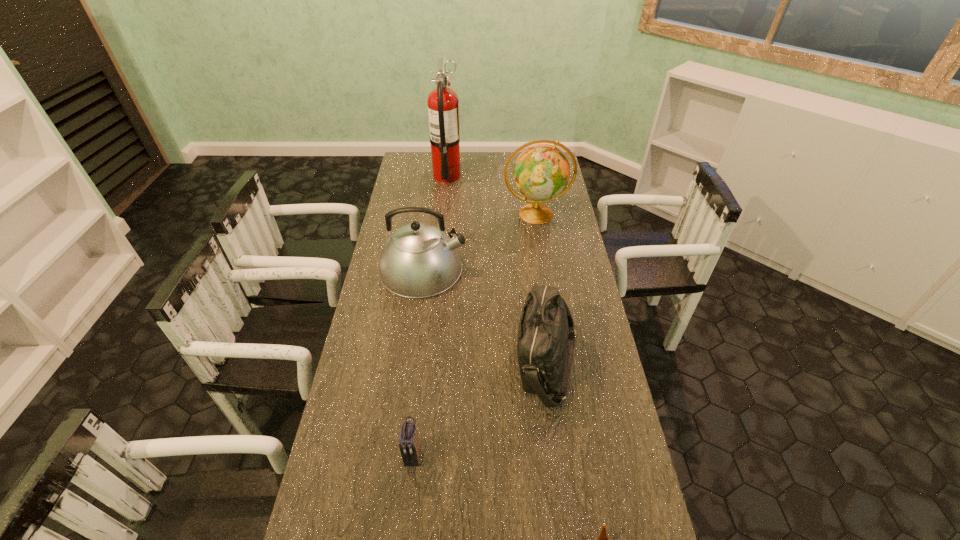
I want to click on vacant area situated from the spout of the kettle, so click(x=564, y=268).

Locate an element on the screen. This screenshot has height=540, width=960. vacant position located at the front padded panel of the shoulder bag is located at coordinates (430, 363).

You are a GUI agent. You are given a task and a screenshot of the screen. Output one action in this format:
    pyautogui.click(x=<x>, y=<y>)
    Task: Click on the vacant region located 0.150m at the front padded panel of the shoulder bag
    This screenshot has width=960, height=540.
    Given the screenshot: What is the action you would take?
    tap(466, 363)

Find the location of `vacant space located 0.220m at the front padded panel of the shoulder bag`. vacant space located 0.220m at the front padded panel of the shoulder bag is located at coordinates (443, 363).

At what (x,y) coordinates should I click in order to perform the action: click on vacant space situated with the zip open on the fifth farthest object. Please return your answer as a coordinate pair (x, y). Looking at the image, I should click on (408, 501).

Image resolution: width=960 pixels, height=540 pixels. I want to click on object at the far edge, so click(443, 104).

I want to click on object located in the left edge section of the desktop, so click(x=419, y=260).

Locate an element on the screen. This screenshot has height=540, width=960. globe that is at the right edge is located at coordinates (541, 172).

Find the location of a particular element. The width and height of the screenshot is (960, 540). shoulder bag located at the right edge is located at coordinates (546, 339).

The width and height of the screenshot is (960, 540). In the image, there is a desktop. In order to click on free space at the far edge in this screenshot , I will do `click(491, 170)`.